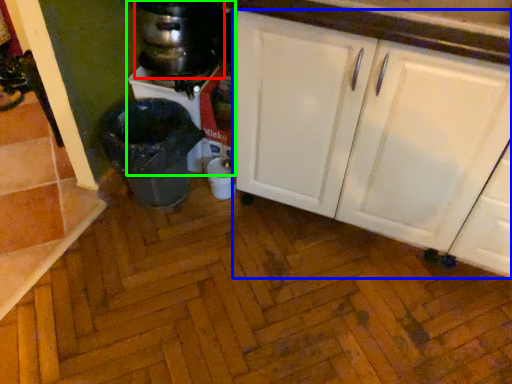
Question: Which object is the closest to the appliance (highlighted by a red box)? Choose among these: cabinetry (highlighted by a blue box) or blender (highlighted by a green box).

Choices:
 (A) cabinetry
 (B) blender

Answer: (B)